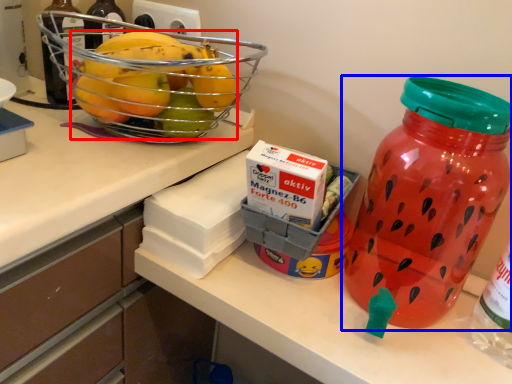
Question: Which object is closer to the camera taking this photo, grapefruit (highlighted by a red box) or bottle (highlighted by a blue box)?

Choices:
 (A) grapefruit
 (B) bottle

Answer: (B)